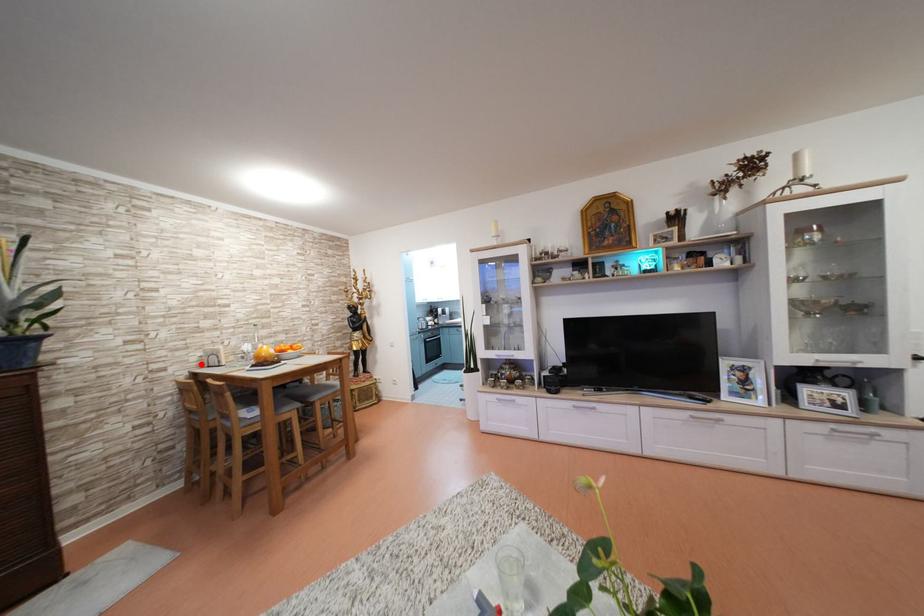
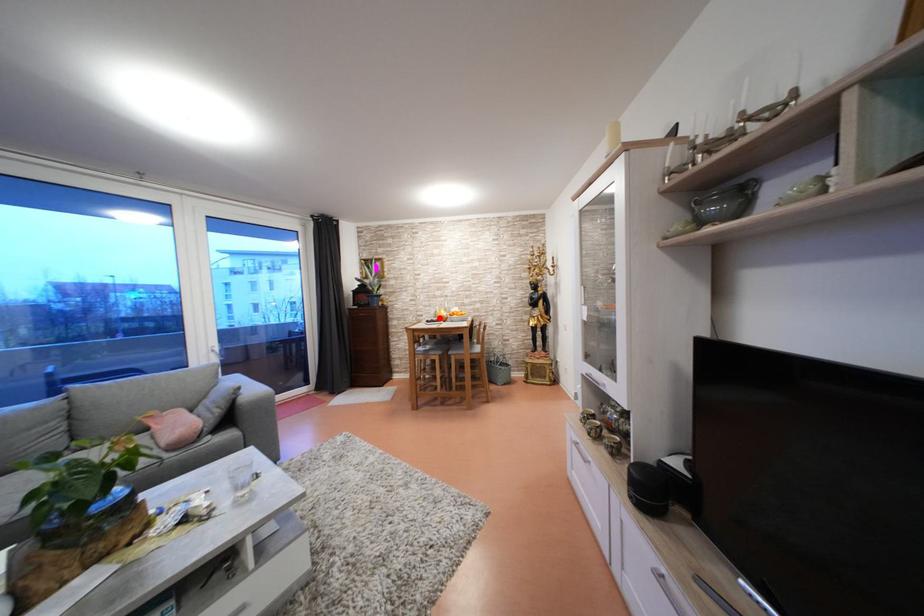
I am providing you with two images of the same scene from different viewpoints. A red point is marked on the first image and another point is marked on the second image. Are the points marked in image1 and image2 representing the same 3D position?

Yes